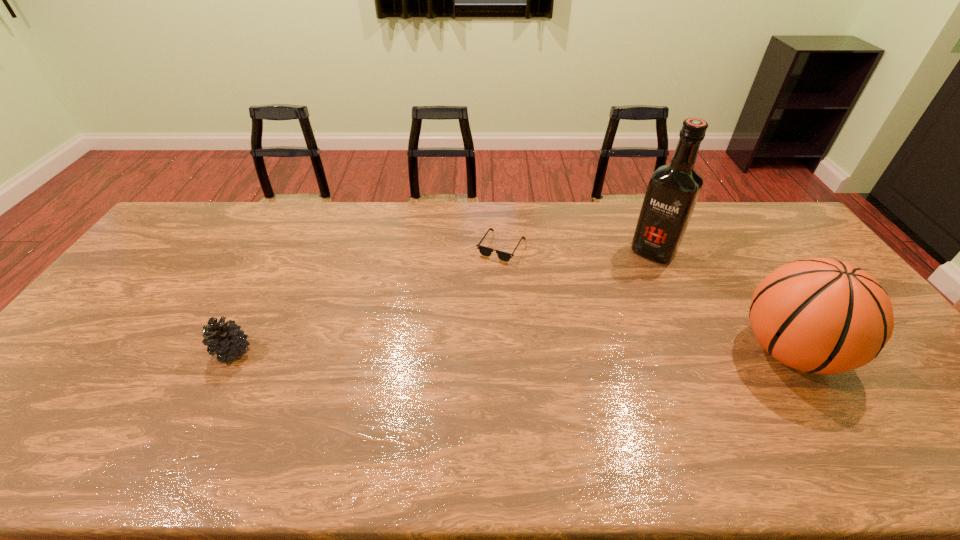
This screenshot has width=960, height=540. I want to click on pinecone, so click(226, 339).

Identify the location of the third tallest object. Image resolution: width=960 pixels, height=540 pixels. (226, 339).

Where is `the rightmost object`? This screenshot has height=540, width=960. the rightmost object is located at coordinates (818, 315).

Find the location of `basketball`. basketball is located at coordinates (818, 315).

Locate an element on the screen. This screenshot has width=960, height=540. the tallest object is located at coordinates [673, 190].

I want to click on liquor, so click(x=673, y=190).

Find the location of `the third object from right to left`. the third object from right to left is located at coordinates (484, 251).

The width and height of the screenshot is (960, 540). Identify the location of the shortest object. (484, 251).

Where is `vacant space located 0.150m on the left of the leftmost object`? vacant space located 0.150m on the left of the leftmost object is located at coordinates (157, 351).

Identify the location of vacant space located on the left of the second tallest object. The image size is (960, 540). (616, 351).